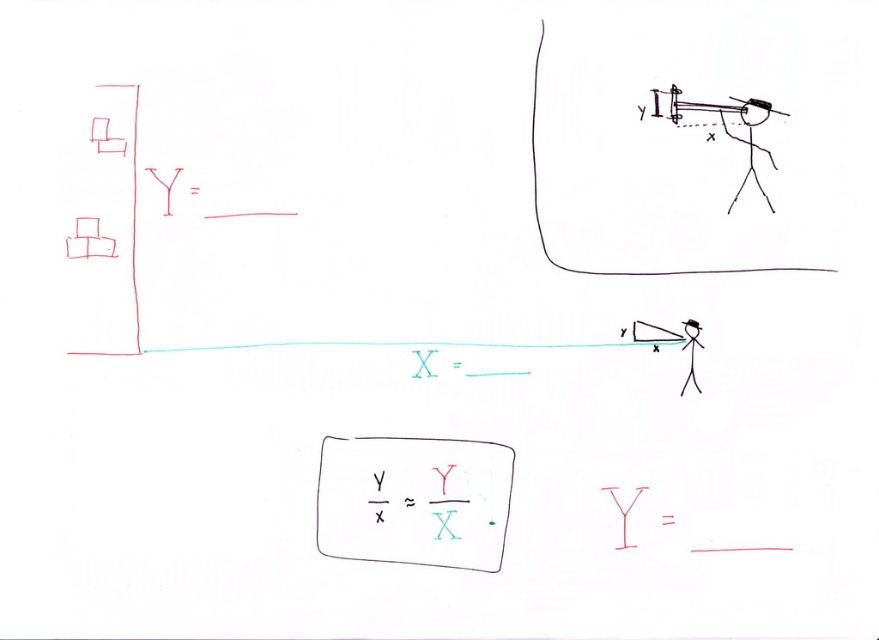
Can you confirm if white paper rectangle at center is smaller than matte black telescope at upper right?

Incorrect, white paper rectangle at center is not smaller in size than matte black telescope at upper right.

Between white paper rectangle at center and matte black telescope at upper right, which one has more height?

With more height is white paper rectangle at center.

Is point (356, 486) farther from viewer compared to point (652, 93)?

Yes, point (356, 486) is farther from viewer.

At what (x,y) coordinates should I click in order to perform the action: click on white paper rectangle at center. Please return your answer as a coordinate pair (x, y). This screenshot has width=879, height=640. Looking at the image, I should click on (413, 500).